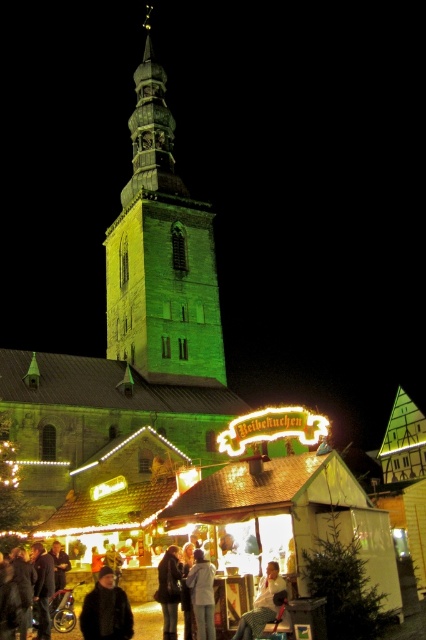
You are a photographer trying to capture both the light brown leather jacket at lower center and the light gray fabric jacket at lower center in a single shot. Which jacket will appear shorter in the photo?

The light brown leather jacket at lower center will appear shorter in the photo because it is not as tall as the light gray fabric jacket at lower center.